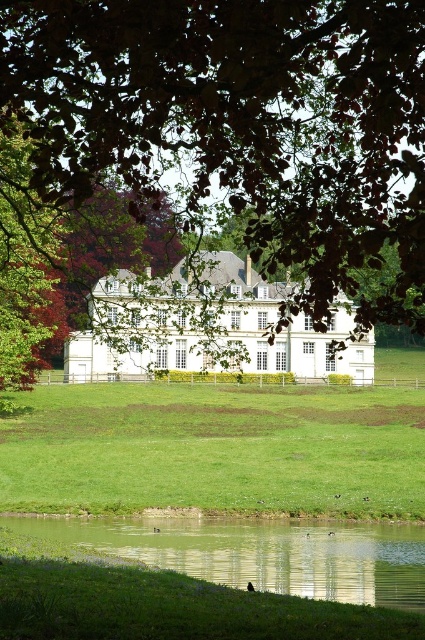
Question: Among these points, which one is farthest from the camera?

Choices:
 (A) (198, 592)
 (B) (388, 534)
 (C) (351, 42)

Answer: (B)

Question: Is green leafy tree at center above green grassy field at lower center?

Choices:
 (A) no
 (B) yes

Answer: (B)

Question: Which object is the farthest from the green grassy at lower center?

Choices:
 (A) green grassy field at lower center
 (B) green reflective water at lower center

Answer: (A)

Question: Among these points, which one is nearest to the camera?

Choices:
 (A) (314, 413)
 (B) (371, 243)

Answer: (B)

Question: Can you confirm if green grassy field at lower center is bigger than green grassy at lower center?

Choices:
 (A) no
 (B) yes

Answer: (B)

Question: Is green leafy tree at center smaller than green grassy at lower center?

Choices:
 (A) yes
 (B) no

Answer: (B)